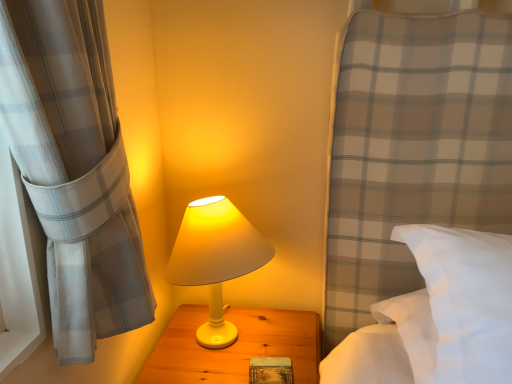
Identify the location of free space to the left of white matte lamp at center. The width and height of the screenshot is (512, 384). (162, 345).